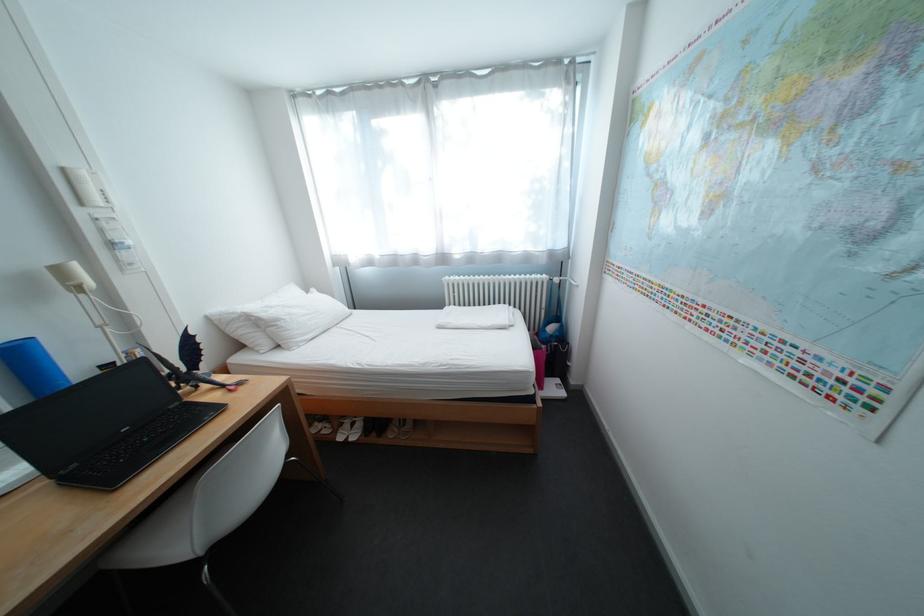
The width and height of the screenshot is (924, 616). What do you see at coordinates (86, 187) in the screenshot?
I see `a intercom handset` at bounding box center [86, 187].